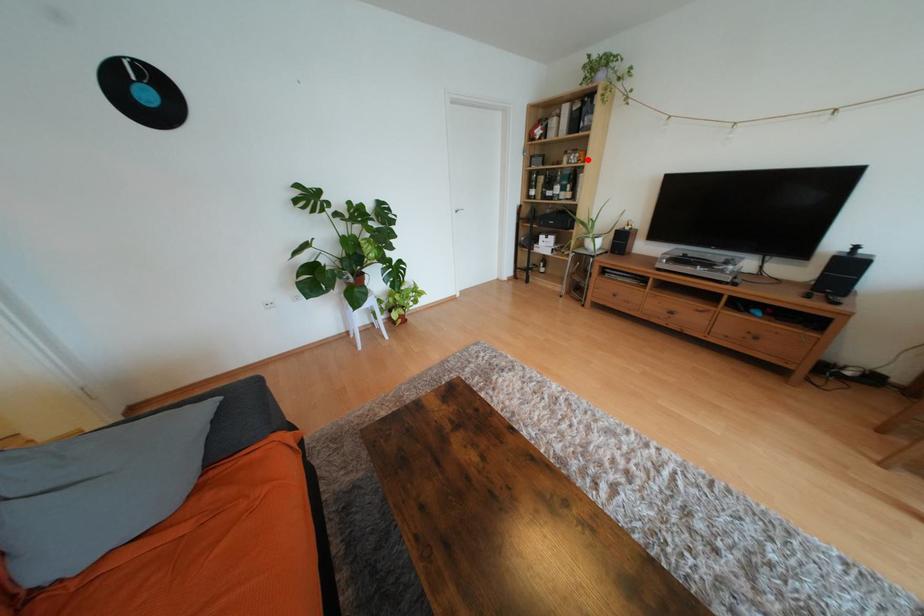
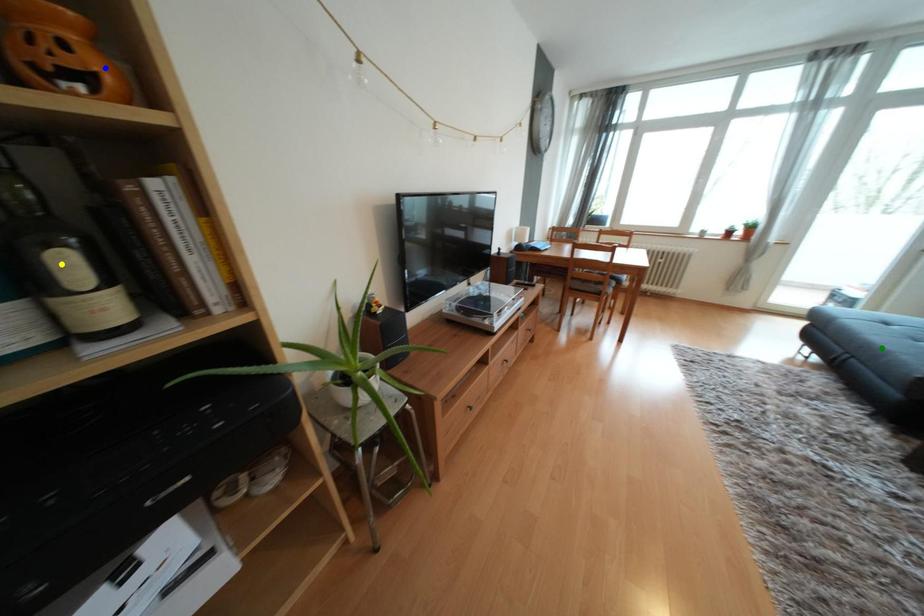
Question: I am providing you with two images of the same scene from different viewpoints. A red point is marked on the first image. You are given multiple points on the second image. Which spot in image 2 lines up with the point in image 1?

Choices:
 (A) green point
 (B) yellow point
 (C) blue point

Answer: (C)